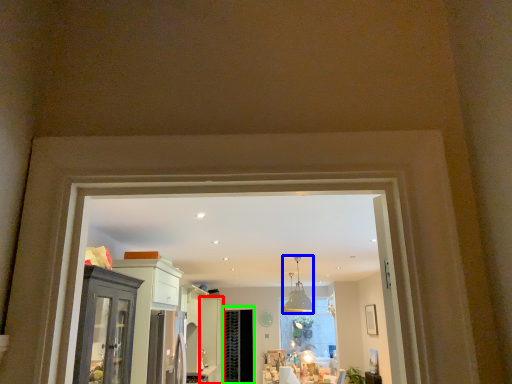
Question: Estimate the real-world distances between objects in this image. Which object is closer to door (highlighted by a red box), light fixture (highlighted by a blue box) or screen door (highlighted by a green box)?

Choices:
 (A) light fixture
 (B) screen door

Answer: (B)